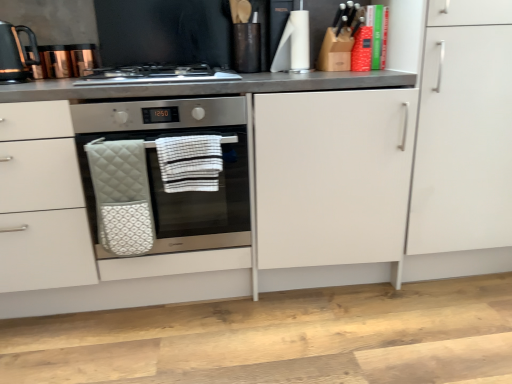
This screenshot has width=512, height=384. What are the coordinates of `free point above white striped fabric hand towel at center, arranged as the first hand towel when viewed from the right (from a real-world perspective)` in the screenshot? It's located at (191, 127).